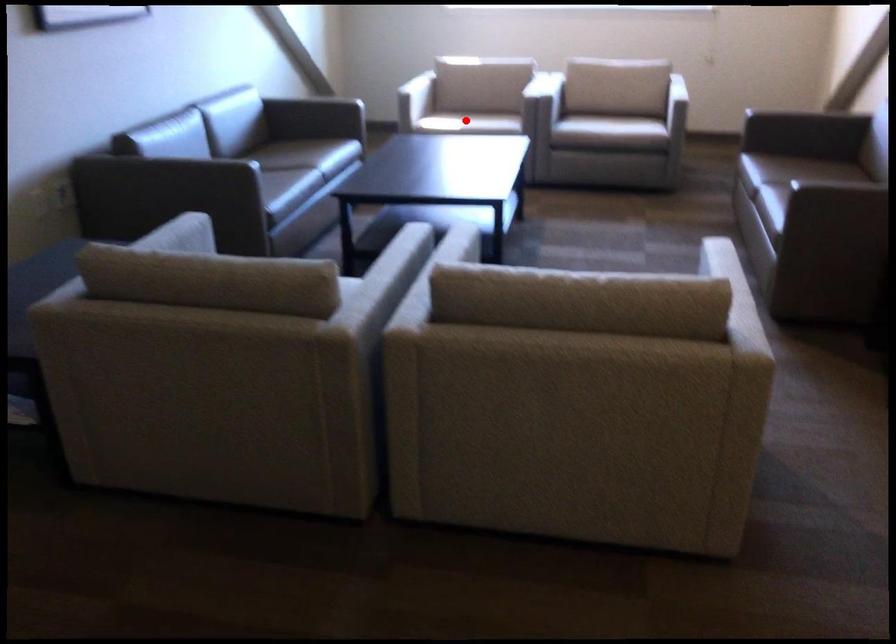
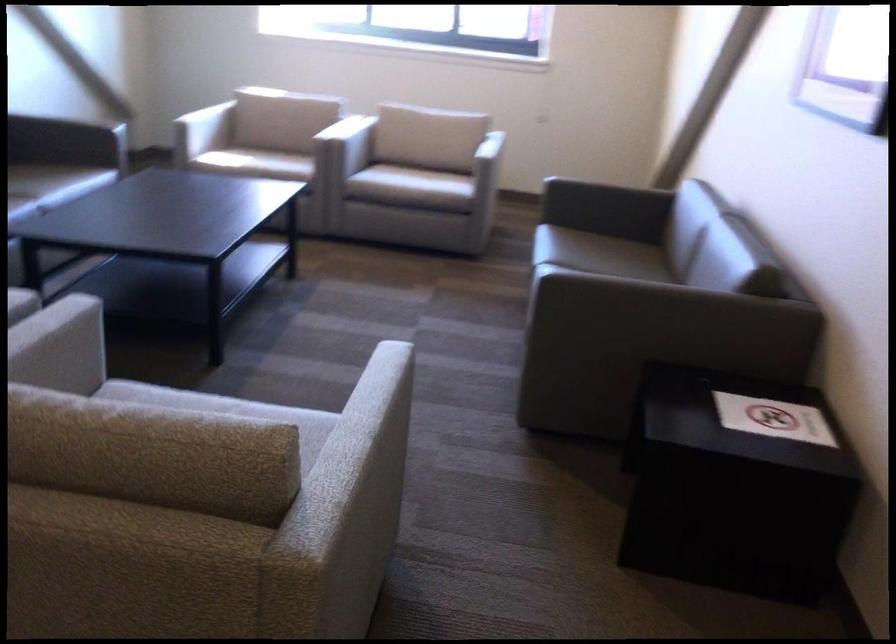
The point at the highlighted location is marked in the first image. Where is the corresponding point in the second image?

(255, 163)